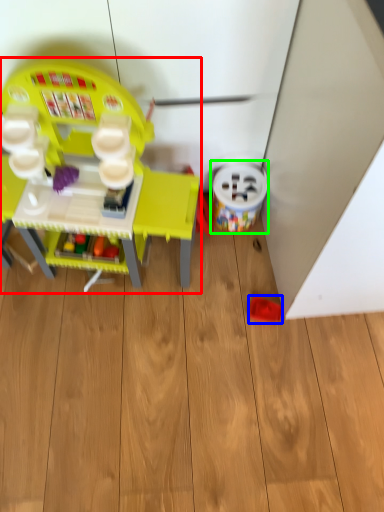
Question: Considering the real-world distances, which object is closest to toy (highlighted by a red box)? toy (highlighted by a blue box) or toy (highlighted by a green box).

Choices:
 (A) toy
 (B) toy

Answer: (B)